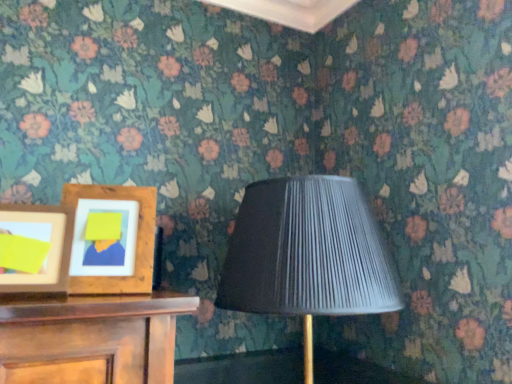
Question: Is the surface of matte black lampshade at center in direct contact with wooden picture frame at left, the first picture frame in the right-to-left sequence?

Choices:
 (A) no
 (B) yes

Answer: (A)

Question: Is matte black lampshade at center far away from wooden picture frame at left, the first picture frame in the right-to-left sequence?

Choices:
 (A) yes
 (B) no

Answer: (B)

Question: Considering the relative positions of matte black lampshade at center and wooden picture frame at left, placed as the 2th picture frame when sorted from left to right, in the image provided, is matte black lampshade at center behind wooden picture frame at left, placed as the 2th picture frame when sorted from left to right,?

Choices:
 (A) yes
 (B) no

Answer: (B)

Question: From a real-world perspective, does matte black lampshade at center sit lower than wooden picture frame at left, the first picture frame in the right-to-left sequence?

Choices:
 (A) no
 (B) yes

Answer: (B)

Question: Would you say matte black lampshade at center is outside wooden picture frame at left, placed as the 2th picture frame when sorted from left to right?

Choices:
 (A) no
 (B) yes

Answer: (B)

Question: From the image's perspective, is matte black lampshade at center positioned above or below wooden picture frame at left, the second picture frame viewed from the right?

Choices:
 (A) above
 (B) below

Answer: (B)

Question: From a real-world perspective, is matte black lampshade at center physically located above or below wooden picture frame at left, the second picture frame viewed from the right?

Choices:
 (A) above
 (B) below

Answer: (B)

Question: Is matte black lampshade at center inside or outside of wooden picture frame at left, the second picture frame viewed from the right?

Choices:
 (A) inside
 (B) outside

Answer: (B)

Question: From their relative heights in the image, would you say matte black lampshade at center is taller or shorter than wooden picture frame at left, which ranks as the first picture frame in left-to-right order?

Choices:
 (A) short
 (B) tall

Answer: (B)

Question: In the image, is matte black lampshade at center positioned in front of or behind wooden picture frame at left, the first picture frame in the right-to-left sequence?

Choices:
 (A) behind
 (B) front

Answer: (B)

Question: Is matte black lampshade at center taller or shorter than wooden picture frame at left, the first picture frame in the right-to-left sequence?

Choices:
 (A) tall
 (B) short

Answer: (A)

Question: Visually, is matte black lampshade at center positioned to the left or to the right of wooden picture frame at left, the first picture frame in the right-to-left sequence?

Choices:
 (A) right
 (B) left

Answer: (A)

Question: Which is correct: matte black lampshade at center is inside wooden picture frame at left, placed as the 2th picture frame when sorted from left to right, or outside of it?

Choices:
 (A) outside
 (B) inside

Answer: (A)

Question: Is wooden picture frame at left, which ranks as the first picture frame in left-to-right order, inside or outside of wooden picture frame at left, placed as the 2th picture frame when sorted from left to right?

Choices:
 (A) inside
 (B) outside

Answer: (B)

Question: Is wooden picture frame at left, the second picture frame viewed from the right, bigger or smaller than wooden picture frame at left, placed as the 2th picture frame when sorted from left to right?

Choices:
 (A) big
 (B) small

Answer: (B)